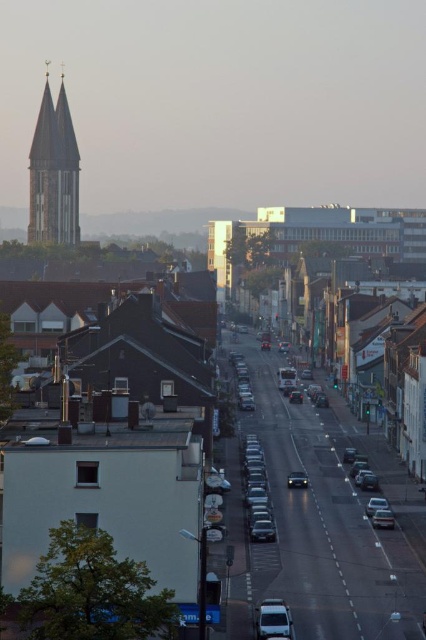
You are a delivery driver who needs to parallel park your shiny metallic car at center between two parked cars. The space between the two cars is exactly the width of the metallic silver car at lower right. Will your car fit into that space?

The shiny metallic car at center is wider than the metallic silver car at lower right. Since the space is only as wide as the metallic silver car at lower right, the shiny metallic car at center will not fit into that space.

You are a delivery driver who needs to park your truck, which is 2.5 meters wide, in a spot between the shiny metallic car at center and the shiny silver sedan at center. Based on the scene, can you determine if there is enough space between them to park your truck?

The shiny metallic car at center might be wider than shiny silver sedan at center, so the space between them may not be sufficient for a truck that is 2.5 meters wide. It is recommended to look for another parking spot.

You are a pedestrian standing at the sidewalk and want to cross the street. You see a shiny metallic car at center and a metallic silver car at lower right. Which car is closer to you?

The shiny metallic car at center is closer to the viewer than the metallic silver car at lower right, so the shiny metallic car at center is closer to you.